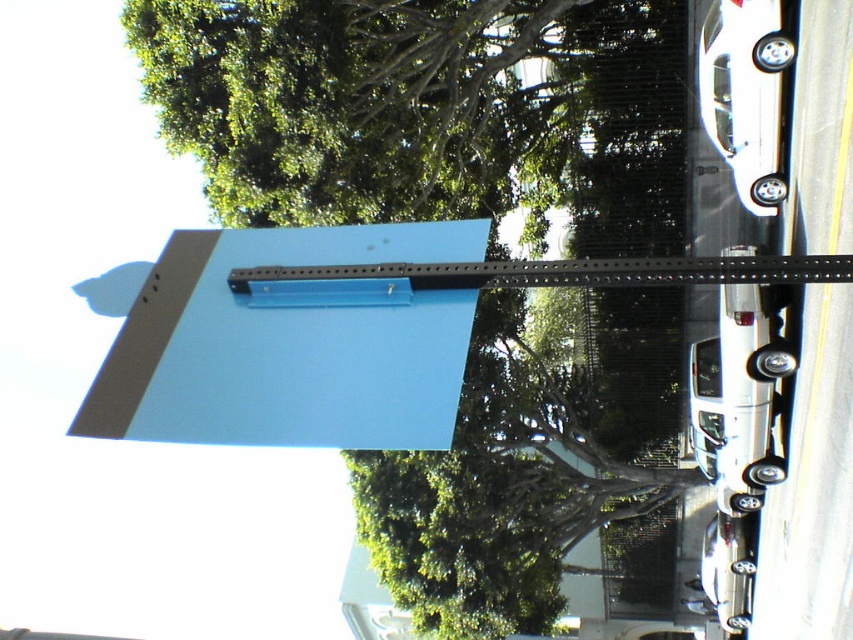
Which is behind, point (560, 168) or point (468, 262)?

Positioned behind is point (560, 168).

Describe the element at coordinates (424, 115) in the screenshot. This screenshot has width=853, height=640. I see `green leafy tree at upper center` at that location.

Who is more forward, (624, 432) or (627, 262)?

Point (627, 262) is in front.

The width and height of the screenshot is (853, 640). Identify the location of green leafy tree at upper center. (424, 115).

Does green leafy tree at upper center appear over blue matte sign at upper center?

No, green leafy tree at upper center is not above blue matte sign at upper center.

Based on the photo, is green leafy tree at upper center behind blue matte sign at upper center?

Yes, it is behind blue matte sign at upper center.

Does point (560, 419) come closer to viewer compared to point (369, 372)?

No, (560, 419) is behind (369, 372).

Identify the location of green leafy tree at upper center. The image size is (853, 640). (424, 115).

Does point (392, 420) lie behind point (340, 288)?

No, it is not.

This screenshot has width=853, height=640. What do you see at coordinates (287, 346) in the screenshot?
I see `blue matte sign at upper center` at bounding box center [287, 346].

The image size is (853, 640). In order to click on blue matte sign at upper center in this screenshot , I will do `click(287, 346)`.